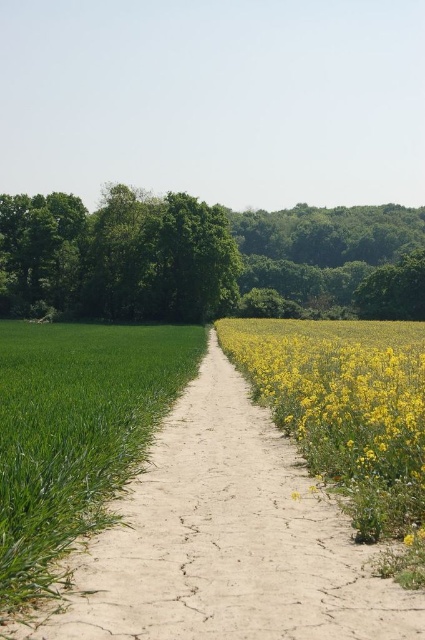
Does dusty brown dirt track at center come behind green leafy tree at upper center?

No, it is in front of green leafy tree at upper center.

Looking at this image, measure the distance between point [153,564] and camera.

The distance of point [153,564] from camera is 19.92 feet.

Where is `dusty brown dirt track at center`? The width and height of the screenshot is (425, 640). dusty brown dirt track at center is located at coordinates (226, 540).

Who is positioned more to the left, green grass at left or yellow matte flowers at center-right?

From the viewer's perspective, green grass at left appears more on the left side.

Which of these two, green grass at left or yellow matte flowers at center-right, stands taller?

yellow matte flowers at center-right

Between point (93, 461) and point (314, 460), which one is positioned behind?

The point (314, 460) is more distant.

Identify the location of green grass at left. This screenshot has width=425, height=640. (74, 433).

Who is more forward, [308,240] or [44,593]?

Point [44,593]

Can you confirm if green leafy tree at upper center is bigger than green grass at left?

Indeed, green leafy tree at upper center has a larger size compared to green grass at left.

Find the location of `green leafy tree at upper center`. green leafy tree at upper center is located at coordinates (204, 259).

Identify the location of green leafy tree at upper center. The image size is (425, 640). (204, 259).